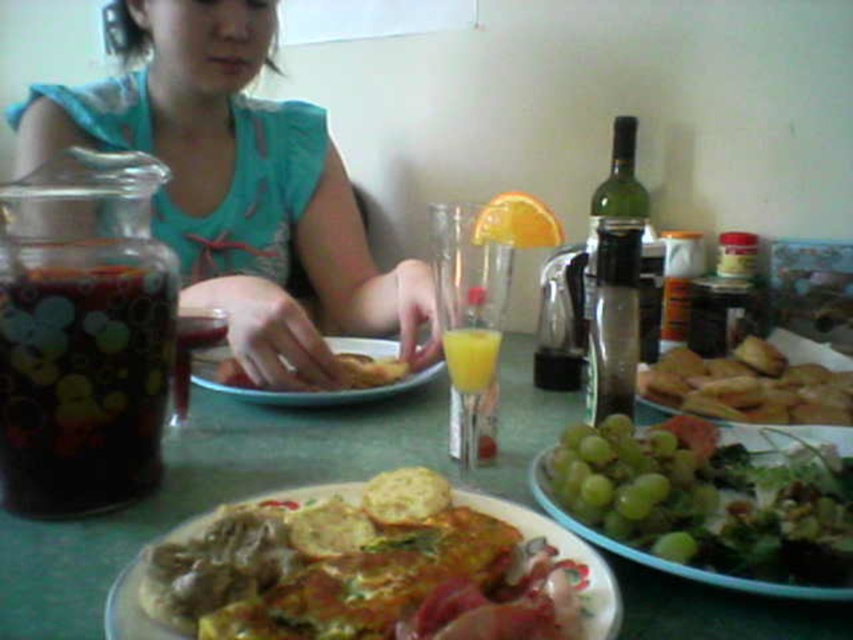
Can you confirm if golden crispy bread at center is positioned above white ceramic plate at center?

No.

Does point (428, 520) come in front of point (296, 404)?

Yes.

You are a GUI agent. You are given a task and a screenshot of the screen. Output one action in this format:
    pyautogui.click(x=<x>, y=<y>)
    Task: Click on the golden crispy bread at center
    This screenshot has width=853, height=640.
    Given the screenshot: What is the action you would take?
    pyautogui.click(x=358, y=570)

Locate an element on the screen. This screenshot has width=853, height=640. golden crispy bread at center is located at coordinates (358, 570).

Looking at this image, is dark glossy jar at left to the left of clear glass bottle at center from the viewer's perspective?

Correct, you'll find dark glossy jar at left to the left of clear glass bottle at center.

Between dark glossy jar at left and clear glass bottle at center, which one has less height?

dark glossy jar at left

Where is `dark glossy jar at left`? Image resolution: width=853 pixels, height=640 pixels. dark glossy jar at left is located at coordinates (82, 385).

Who is more distant from viewer, (271, 100) or (630, 268)?

The point (271, 100) is behind.

Can you confirm if blue fabric shirt at upper left is shorter than clear glass bottle at center?

In fact, blue fabric shirt at upper left may be taller than clear glass bottle at center.

This screenshot has height=640, width=853. Find the location of `blue fabric shirt at upper left`. blue fabric shirt at upper left is located at coordinates (238, 188).